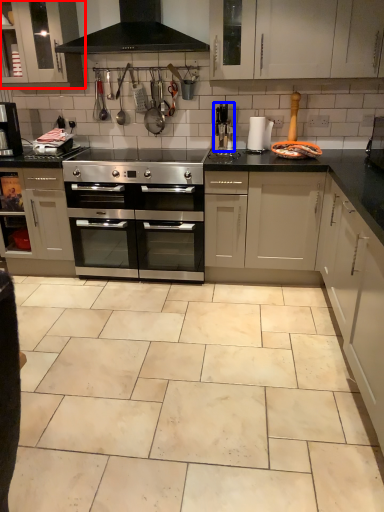
Question: Which of the following is the closest to the observer, cabinetry (highlighted by a red box) or appliance (highlighted by a blue box)?

Choices:
 (A) cabinetry
 (B) appliance

Answer: (A)